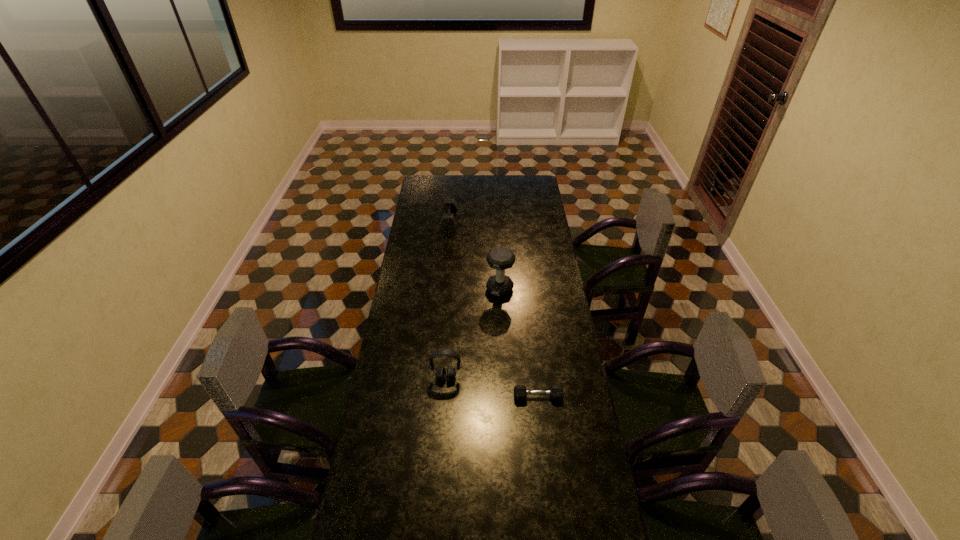
This screenshot has height=540, width=960. I want to click on unoccupied area between the nearest dumbbell and the third farthest object, so click(x=492, y=387).

Find the location of a particular element. Image resolution: width=960 pixels, height=540 pixels. vacant point located between the farthest dumbbell and the headset is located at coordinates (447, 300).

Image resolution: width=960 pixels, height=540 pixels. In order to click on vacant area between the second nearest object and the second farthest object in this screenshot , I will do `click(473, 334)`.

I want to click on vacant space in between the second tallest dumbbell and the headset, so click(x=447, y=300).

Image resolution: width=960 pixels, height=540 pixels. In order to click on vacant area that lies between the tallest dumbbell and the leftmost dumbbell in this screenshot , I will do `click(474, 255)`.

This screenshot has height=540, width=960. Find the location of `vacant area that lies between the third tallest object and the nearest dumbbell`. vacant area that lies between the third tallest object and the nearest dumbbell is located at coordinates (493, 309).

You are a GUI agent. You are given a task and a screenshot of the screen. Output one action in this format:
    pyautogui.click(x=<x>, y=<y>)
    Task: Click on the vacant space that is in between the second farthest object and the farthest object
    
    Given the screenshot: What is the action you would take?
    pyautogui.click(x=474, y=255)

Image resolution: width=960 pixels, height=540 pixels. In order to click on object that stands as the second closest to the shortest dumbbell in this screenshot , I will do `click(500, 258)`.

Find the location of a particular element. The height and width of the screenshot is (540, 960). object that is the third closest to the third nearest object is located at coordinates (556, 392).

Identify which dumbbell is the third closest to the second tallest object. Please provide its 2D coordinates. Your answer should be formatted as a tuple, i.e. [(x, y)], where the tuple contains the x and y coordinates of a point satisfying the conditions above.

[(447, 222)]